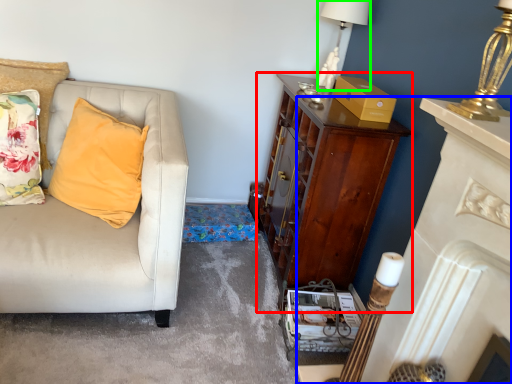
Question: Considering the real-world distances, which object is closest to cabinetry (highlighted by a red box)? fireplace (highlighted by a blue box) or lamp (highlighted by a green box).

Choices:
 (A) fireplace
 (B) lamp

Answer: (B)